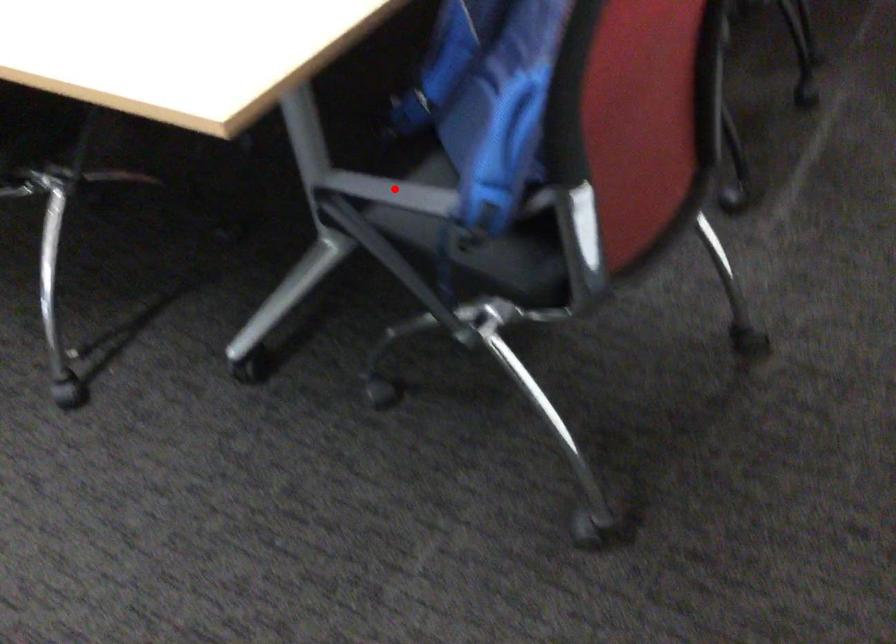
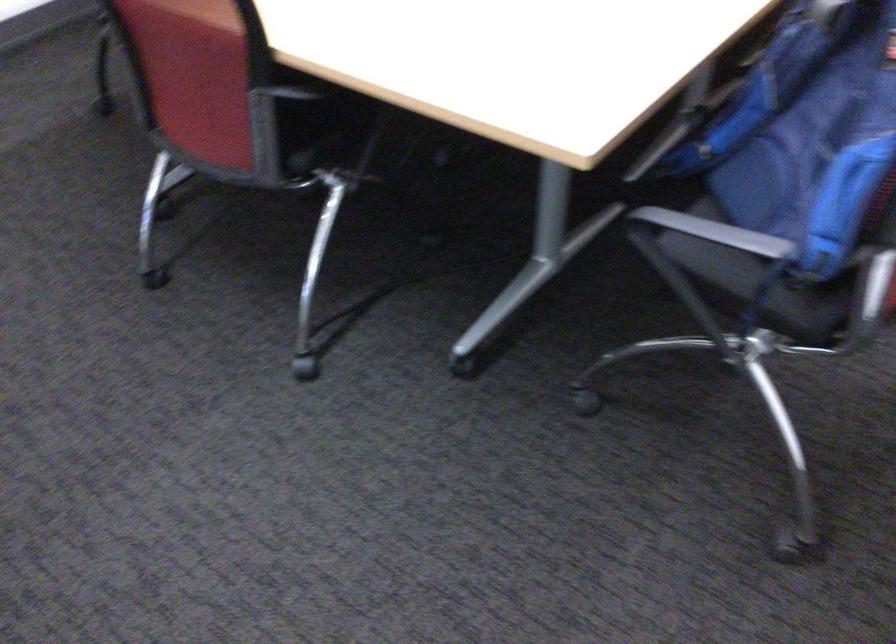
Question: I am providing you with two images of the same scene from different viewpoints. Given a red point in image1, look at the same physical point in image2. Is it:

Choices:
 (A) Closer to the viewpoint
 (B) Farther from the viewpoint

Answer: (B)